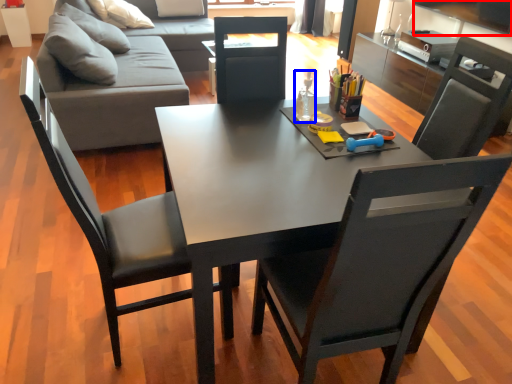
Question: Which object is further to the camera taking this photo, television (highlighted by a red box) or bottle (highlighted by a blue box)?

Choices:
 (A) television
 (B) bottle

Answer: (A)